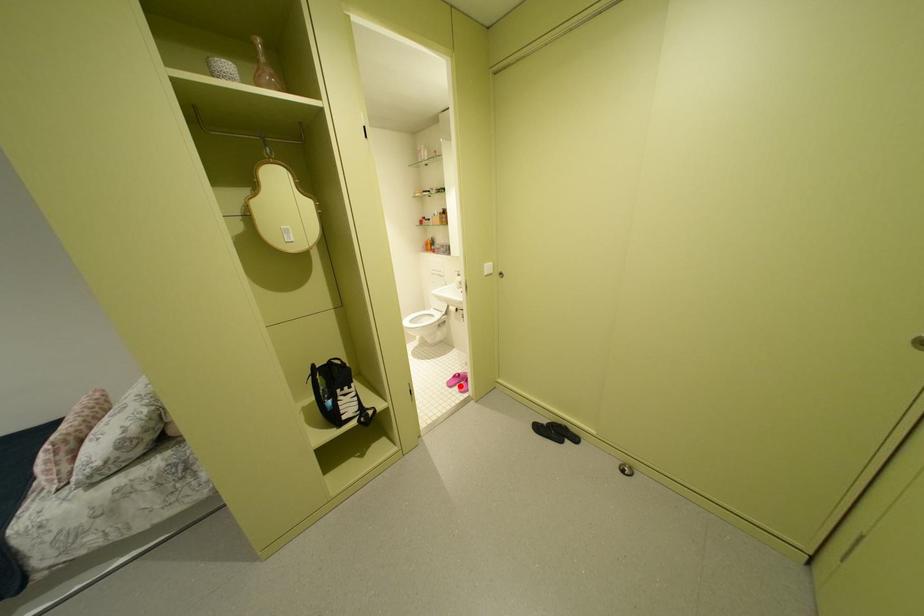
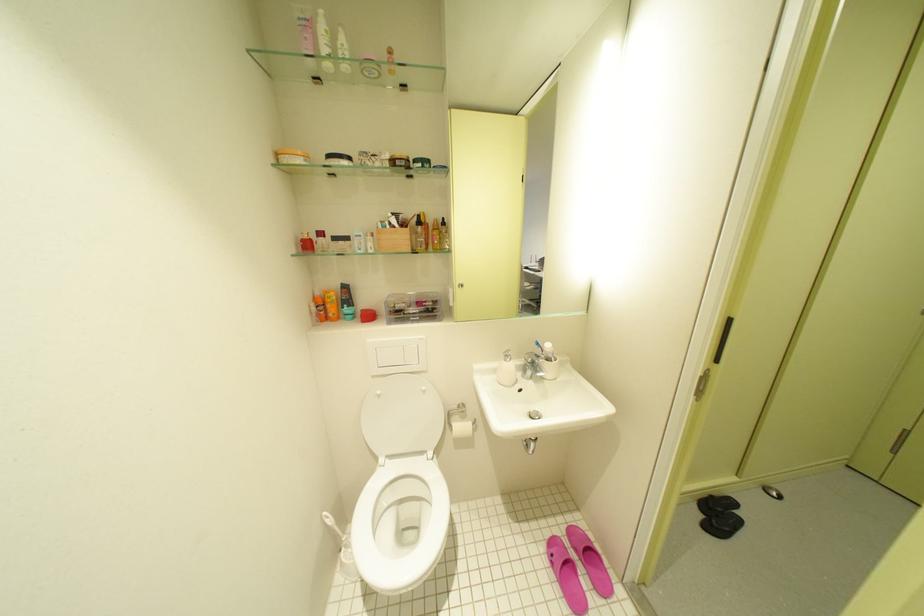
In the second image, find the point that corresponds to the highlighted location in the first image.

(587, 604)